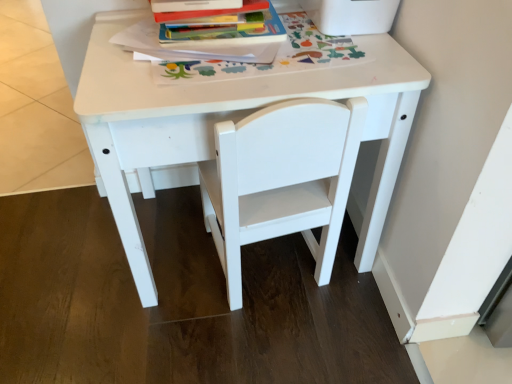
This screenshot has height=384, width=512. Identify the location of vacant area on top of white matte chair at center (from a real-world perspective). (262, 65).